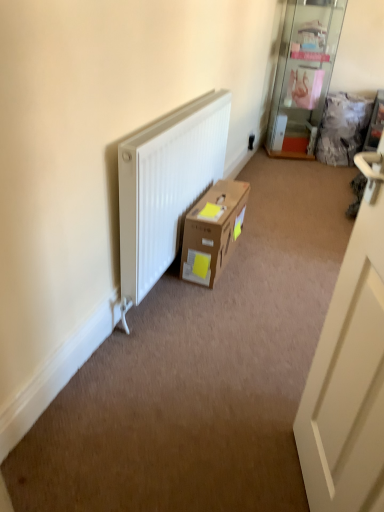
Question: Is white matte door at right inside brown cardboard box at center?

Choices:
 (A) yes
 (B) no

Answer: (B)

Question: Can you confirm if brown cardboard box at center is taller than white matte door at right?

Choices:
 (A) yes
 (B) no

Answer: (B)

Question: Is brown cardboard box at center facing towards white matte door at right?

Choices:
 (A) no
 (B) yes

Answer: (A)

Question: From the image's perspective, does brown cardboard box at center appear lower than white matte door at right?

Choices:
 (A) no
 (B) yes

Answer: (A)

Question: Is brown cardboard box at center wider than white matte door at right?

Choices:
 (A) no
 (B) yes

Answer: (B)

Question: From a real-world perspective, is brown cardboard box at center located higher than white matte door at right?

Choices:
 (A) yes
 (B) no

Answer: (B)

Question: Considering the relative sizes of white matte door at right and brown cardboard box at center in the image provided, is white matte door at right shorter than brown cardboard box at center?

Choices:
 (A) no
 (B) yes

Answer: (A)

Question: Is the depth of white matte door at right greater than that of brown cardboard box at center?

Choices:
 (A) yes
 (B) no

Answer: (B)

Question: Is white matte door at right far away from brown cardboard box at center?

Choices:
 (A) no
 (B) yes

Answer: (B)

Question: Is white matte door at right at the right side of brown cardboard box at center?

Choices:
 (A) yes
 (B) no

Answer: (A)

Question: Can you see white matte door at right touching brown cardboard box at center?

Choices:
 (A) no
 (B) yes

Answer: (A)

Question: Would you say white matte door at right contains brown cardboard box at center?

Choices:
 (A) no
 (B) yes

Answer: (A)

Question: From the image's perspective, does white matte door at right appear higher than transparent glass shelf at upper right?

Choices:
 (A) yes
 (B) no

Answer: (B)